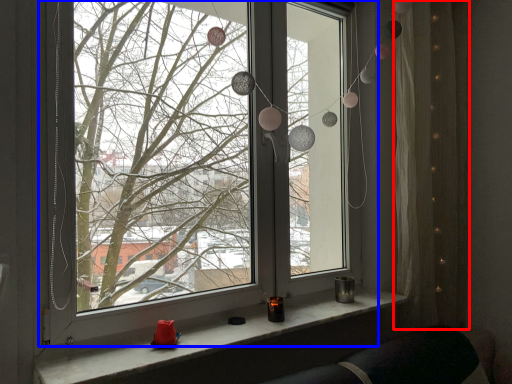
Question: Which point is closer to the camera, curtain (highlighted by a red box) or window (highlighted by a blue box)?

Choices:
 (A) curtain
 (B) window

Answer: (B)